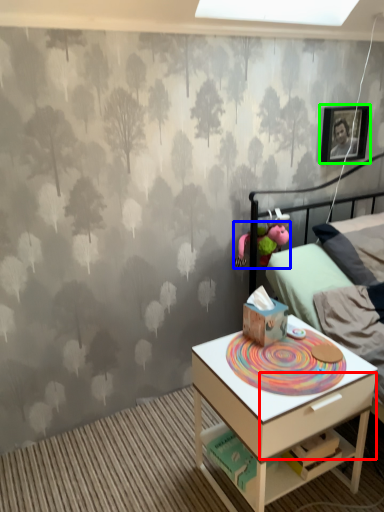
Question: Which object is the closest to the drawer (highlighted by a red box)? Choose among these: toy (highlighted by a blue box) or picture frame (highlighted by a green box).

Choices:
 (A) toy
 (B) picture frame

Answer: (A)